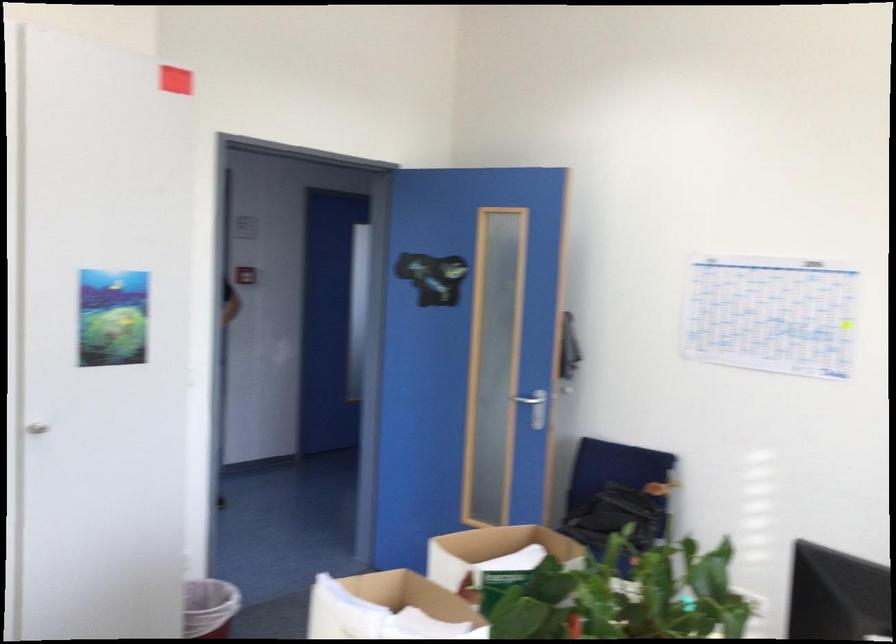
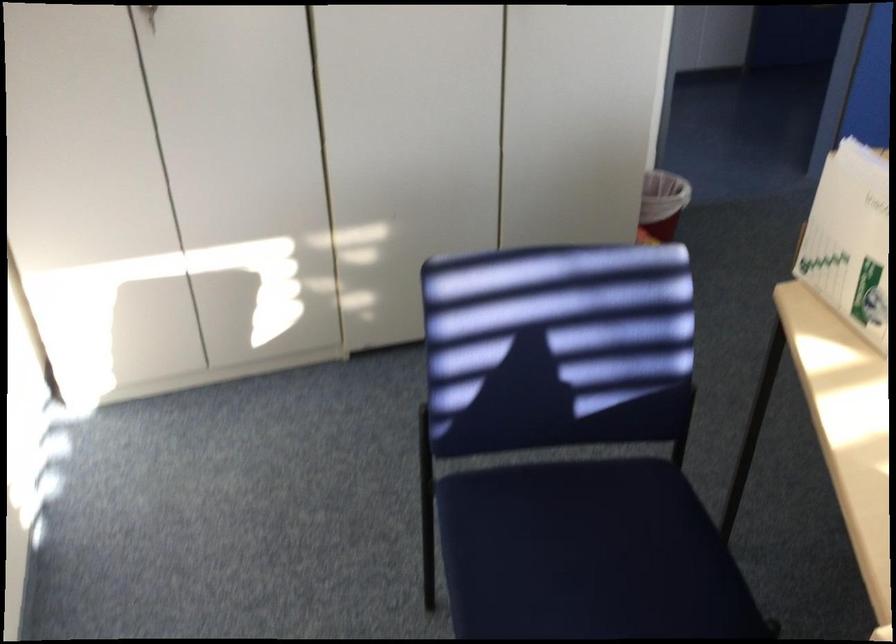
How did the camera likely rotate?

The camera's rotation is toward left-down.